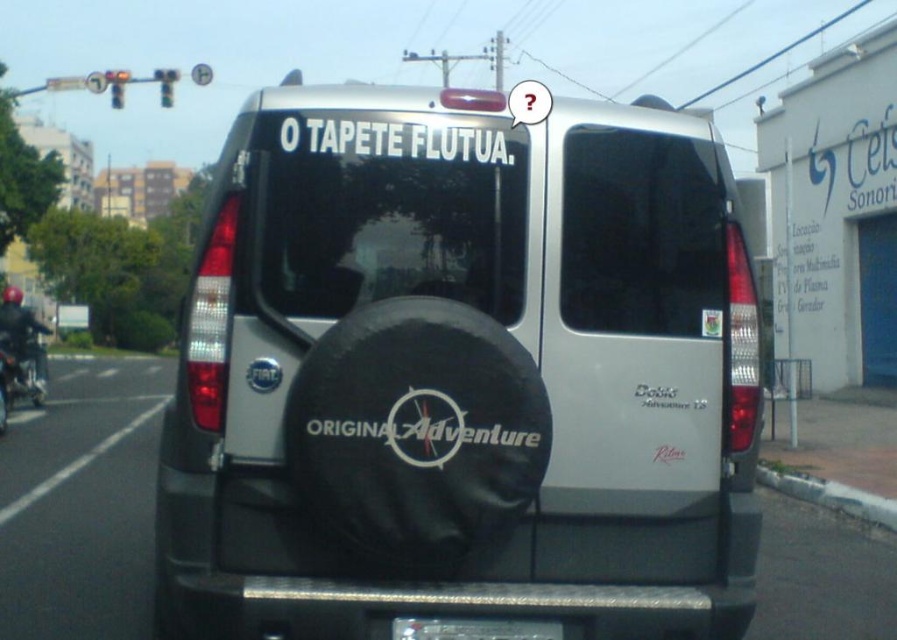
You are a delivery driver who needs to attach a new sticker to the spare tire. Given the sizes of the silver matte spare tire at center and the white matte sticker at center, will the sticker fit without overlapping the edges?

The silver matte spare tire at center is narrower than the white matte sticker at center, so the sticker will overlap the edges of the tire and not fit properly.